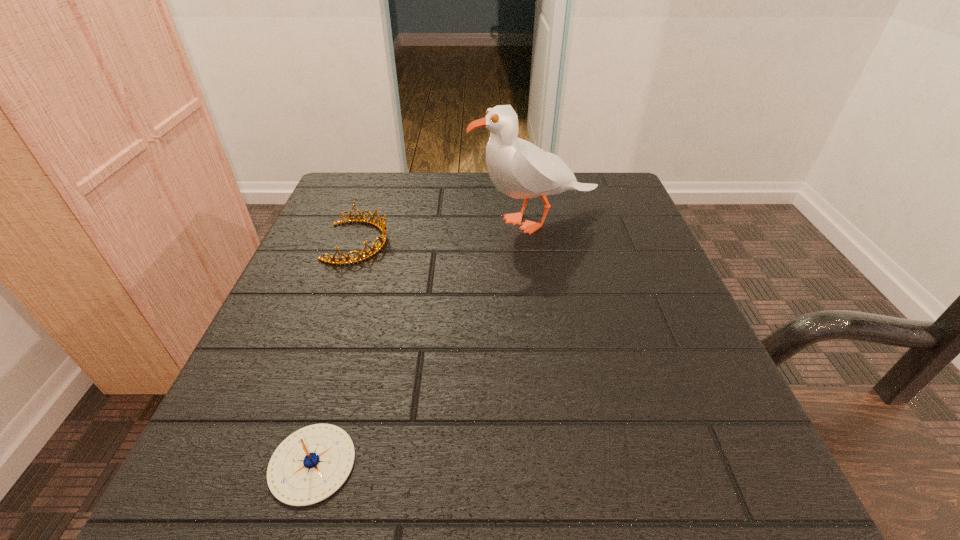
At what (x,y) coordinates should I click in order to perform the action: click on free space between the nearest object and the rightmost object. Please return your answer as a coordinate pair (x, y). Looking at the image, I should click on (423, 342).

This screenshot has width=960, height=540. Find the location of `vacant point located between the tallest object and the nearest object`. vacant point located between the tallest object and the nearest object is located at coordinates (423, 342).

Where is `free space between the shortest object and the rightmost object`? Image resolution: width=960 pixels, height=540 pixels. free space between the shortest object and the rightmost object is located at coordinates (423, 342).

Locate an element on the screen. This screenshot has height=540, width=960. unoccupied area between the tiara and the gull is located at coordinates (446, 232).

At what (x,y) coordinates should I click in order to perform the action: click on vacant space that's between the shortest object and the tiara. Please return your answer as a coordinate pair (x, y). This screenshot has width=960, height=540. Looking at the image, I should click on (335, 353).

Where is `empty space between the nearest object and the tiara`? This screenshot has width=960, height=540. empty space between the nearest object and the tiara is located at coordinates (335, 353).

What are the coordinates of `object that stands as the closest to the tallest object` in the screenshot? It's located at (381, 226).

Select which object appears as the closest to the tallest object. Please provide its 2D coordinates. Your answer should be formatted as a tuple, i.e. [(x, y)], where the tuple contains the x and y coordinates of a point satisfying the conditions above.

[(381, 226)]

What are the coordinates of `blank area in the image that satisfies the following two spatial constraints: 1. at the beak of the tallest object; 2. on the front side of the shortest object` in the screenshot? It's located at (575, 463).

Locate an element on the screen. The image size is (960, 540). vacant space that satisfies the following two spatial constraints: 1. on the front-facing side of the shortest object; 2. on the right side of the second tallest object is located at coordinates (281, 463).